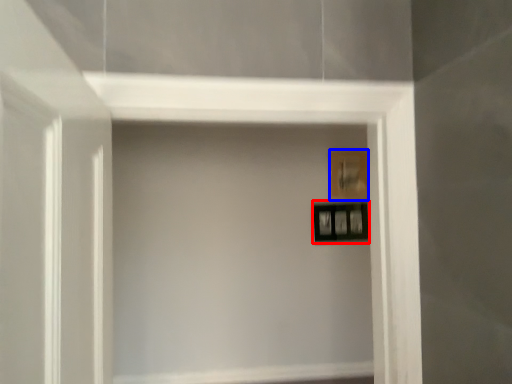
Question: Which of the following is the closest to the observer, picture frame (highlighted by a red box) or picture frame (highlighted by a blue box)?

Choices:
 (A) picture frame
 (B) picture frame

Answer: (A)